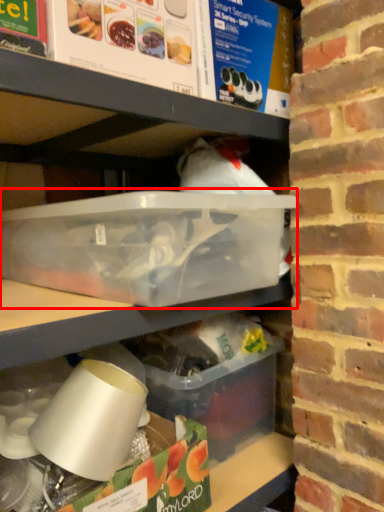
Question: Where is box (annotated by the red box) located in relation to box in the image?

Choices:
 (A) left
 (B) right

Answer: (A)